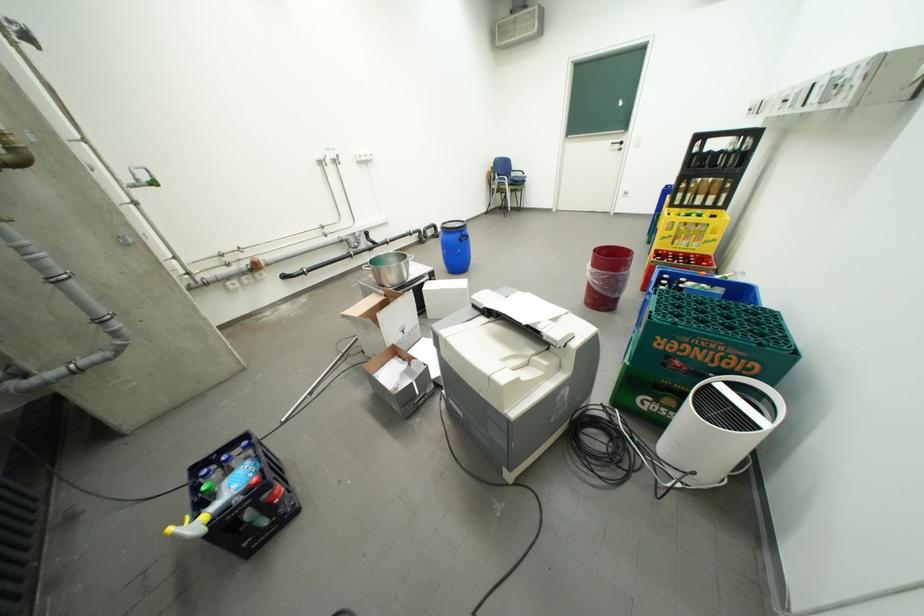
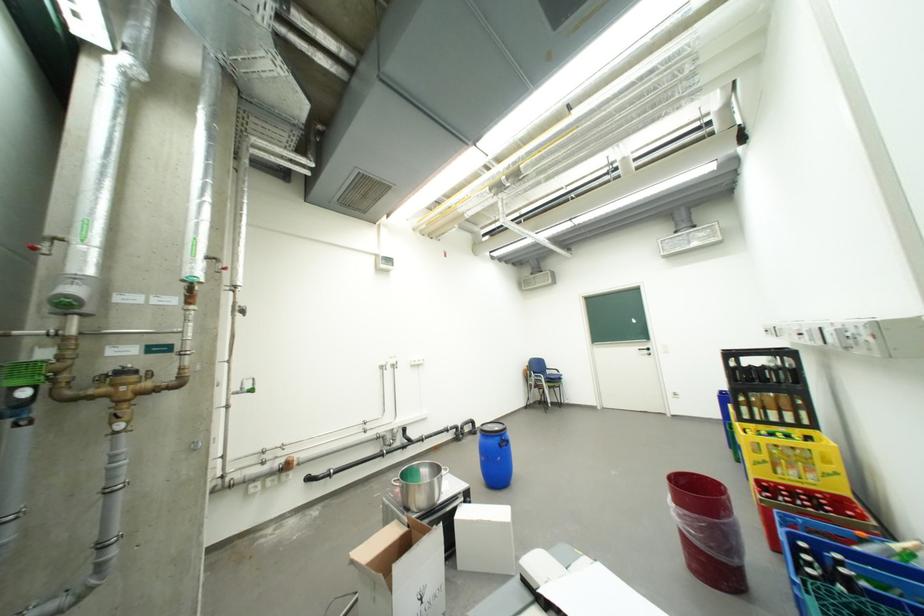
Locate, in the second image, the point that corresponds to the point at 380,321 in the first image.

(392, 577)